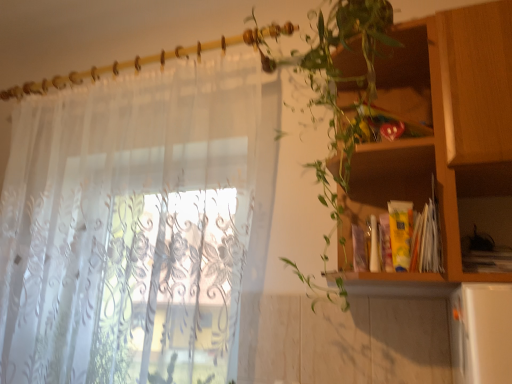
Question: In terms of height, does green leafy plant at upper right look taller or shorter compared to wooden cabinet at right?

Choices:
 (A) short
 (B) tall

Answer: (B)

Question: From the image's perspective, is green leafy plant at upper right above or below wooden cabinet at right?

Choices:
 (A) below
 (B) above

Answer: (B)

Question: Estimate the real-world distances between objects in this image. Which object is farther from the wooden cabinet at right?

Choices:
 (A) green leafy plant at upper right
 (B) translucent white curtain at left

Answer: (B)

Question: Considering the real-world distances, which object is closest to the green leafy plant at upper right?

Choices:
 (A) translucent white curtain at left
 (B) wooden cabinet at right

Answer: (B)